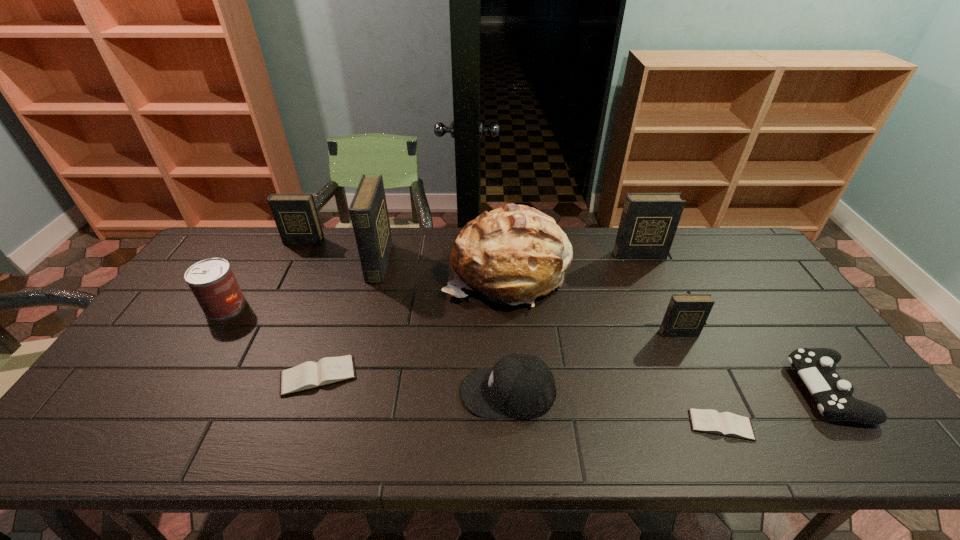
The height and width of the screenshot is (540, 960). What are the coordinates of `vacant space that's between the tallest diary and the rightmost object` in the screenshot? It's located at (603, 327).

I want to click on free area in between the third nearest diary and the fifth farthest diary, so click(x=498, y=354).

Identify the location of free space between the leftmost object and the left brown diary. The height and width of the screenshot is (540, 960). (272, 341).

Identify which object is located as the fourth nearest to the third smallest dark diary. Please provide its 2D coordinates. Your answer should be formatted as a tuple, i.e. [(x, y)], where the tuple contains the x and y coordinates of a point satisfying the conditions above.

[(521, 386)]

Point out which object is positioned as the third nearest to the leftmost object. Please provide its 2D coordinates. Your answer should be formatted as a tuple, i.e. [(x, y)], where the tuple contains the x and y coordinates of a point satisfying the conditions above.

[(368, 210)]

Select which diary is the fourth closest to the second dark diary from left to right. Please provide its 2D coordinates. Your answer should be formatted as a tuple, i.e. [(x, y)], where the tuple contains the x and y coordinates of a point satisfying the conditions above.

[(686, 314)]

The width and height of the screenshot is (960, 540). Find the location of `the fifth closest diary to the third smallest dark diary`. the fifth closest diary to the third smallest dark diary is located at coordinates (296, 217).

Point out which dark diary is positioned as the third nearest to the third smallest dark diary. Please provide its 2D coordinates. Your answer should be formatted as a tuple, i.e. [(x, y)], where the tuple contains the x and y coordinates of a point satisfying the conditions above.

[(296, 217)]

This screenshot has height=540, width=960. Find the location of `the closest dark diary relative to the ninth tallest object`. the closest dark diary relative to the ninth tallest object is located at coordinates (368, 210).

Image resolution: width=960 pixels, height=540 pixels. I want to click on free space that satisfies the following two spatial constraints: 1. on the front cover of the fourth tallest diary; 2. on the front-facing side of the cap, so click(x=705, y=392).